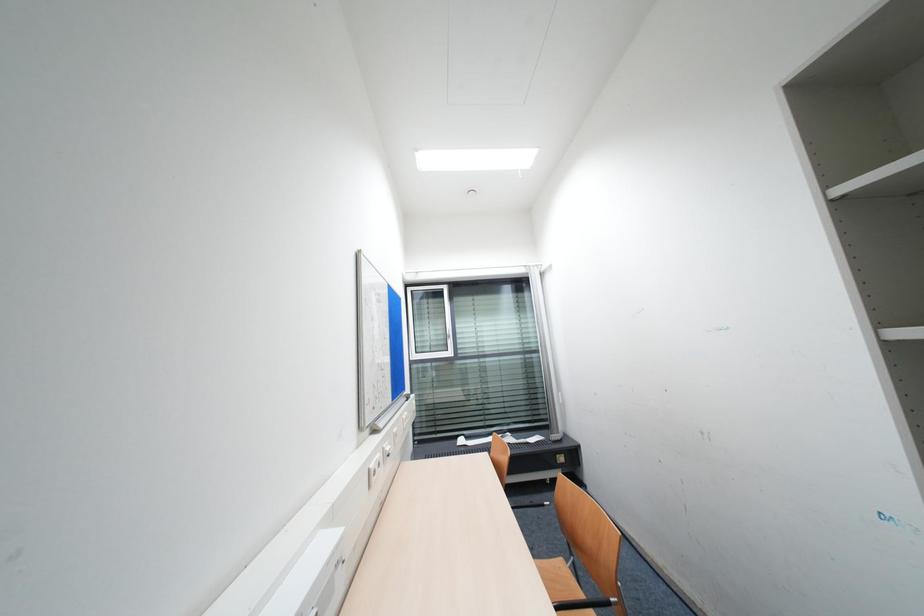
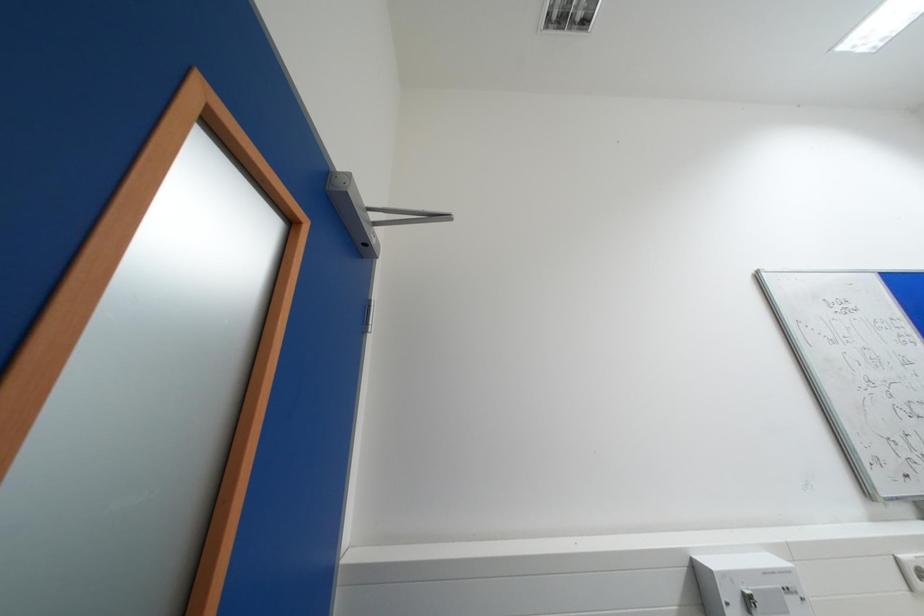
The first image is from the beginning of the video and the second image is from the end. How did the camera likely rotate when shooting the video?

The camera rotated toward left-up.